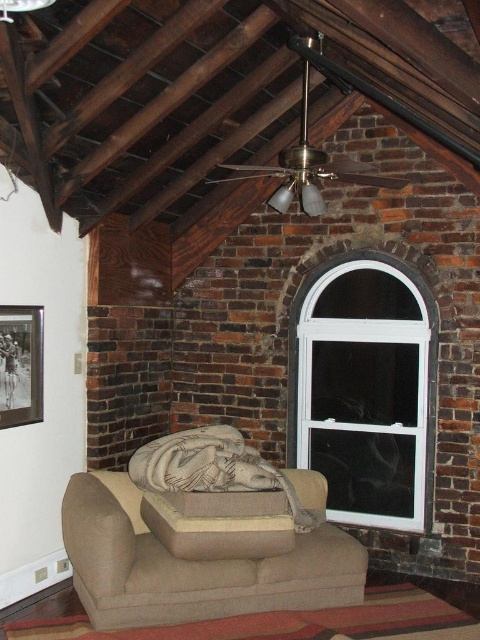
Which is behind, point (355, 604) or point (314, 458)?

The point (314, 458) is more distant.

Which is above, beige fabric couch at center or white plastic window at upper right?

white plastic window at upper right

What do you see at coordinates (199, 554) in the screenshot? I see `beige fabric couch at center` at bounding box center [199, 554].

This screenshot has width=480, height=640. I want to click on beige fabric couch at center, so click(x=199, y=554).